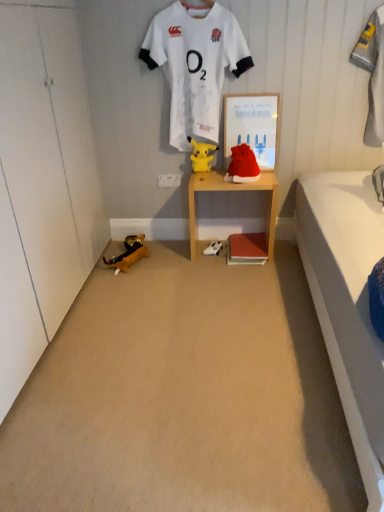
Question: Looking at their shapes, would you say yellow plush toy at center, which appears as the 1th toy when viewed from the top, is wider or thinner than yellow plush toy at lower left, which is the 3th toy from top to bottom?

Choices:
 (A) thin
 (B) wide

Answer: (A)

Question: From the image's perspective, is yellow plush toy at center, the 2th toy viewed from the right, located above or below yellow plush toy at lower left, the first toy positioned from the left?

Choices:
 (A) below
 (B) above

Answer: (B)

Question: Which of these objects is positioned closest to the gray fabric towel at upper right?

Choices:
 (A) white jersey at upper center
 (B) white fabric shoe at lower center
 (C) red velvet santa hat at center, positioned as the 2th toy in bottom-to-top order
 (D) wooden shelf at center
 (E) white paper at center

Answer: (E)

Question: Which object is the closest to the red velvet santa hat at center, the 2th toy when ordered from top to bottom?

Choices:
 (A) wooden shelf at center
 (B) gray fabric towel at upper right
 (C) white fabric shoe at lower center
 (D) white jersey at upper center
 (E) yellow plush toy at lower left, the 3th toy positioned from the right

Answer: (A)